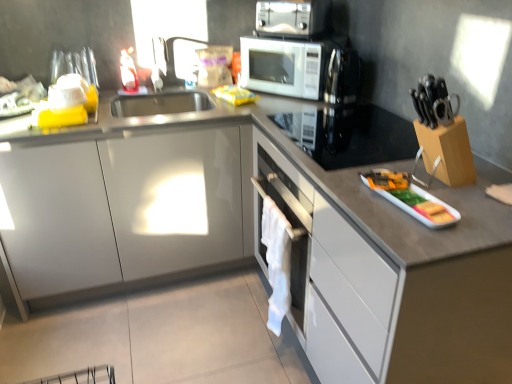
This screenshot has width=512, height=384. What are the coordinates of `free spot to the left of white glossy tray at right, the second appliance in the top-to-bottom sequence` in the screenshot? It's located at (353, 196).